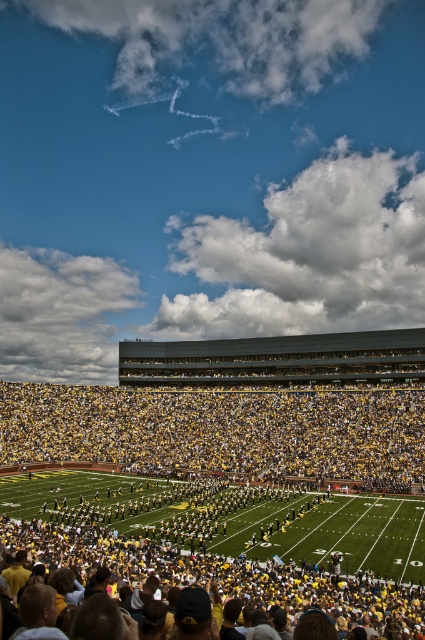
Question: Considering the relative positions of yellow-green uniformed band at center and yellow/yellowish fabric crowd at center in the image provided, where is yellow-green uniformed band at center located with respect to yellow/yellowish fabric crowd at center?

Choices:
 (A) right
 (B) left

Answer: (A)

Question: Does yellow-green uniformed band at center have a lesser width compared to yellow/yellowish fabric crowd at center?

Choices:
 (A) no
 (B) yes

Answer: (B)

Question: Which object is farther from the camera taking this photo?

Choices:
 (A) yellow-green uniformed band at center
 (B) yellow/yellowish fabric crowd at center

Answer: (B)

Question: Which point is closer to the camera?

Choices:
 (A) yellow/yellowish fabric crowd at center
 (B) yellow-green uniformed band at center

Answer: (B)

Question: Does yellow-green uniformed band at center have a smaller size compared to yellow/yellowish fabric crowd at center?

Choices:
 (A) yes
 (B) no

Answer: (B)